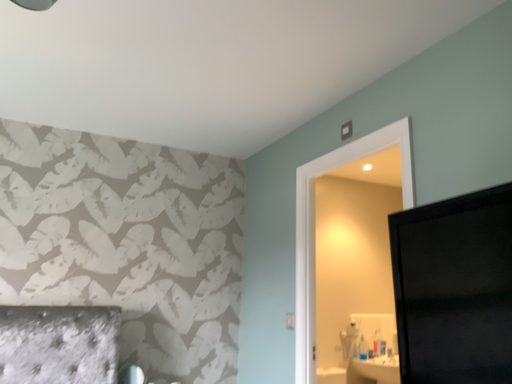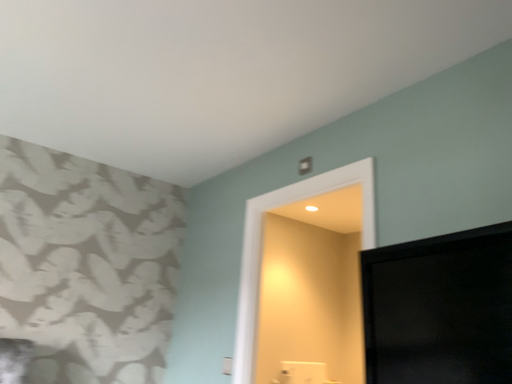
Question: Which way did the camera rotate in the video?

Choices:
 (A) rotated left
 (B) rotated right

Answer: (B)